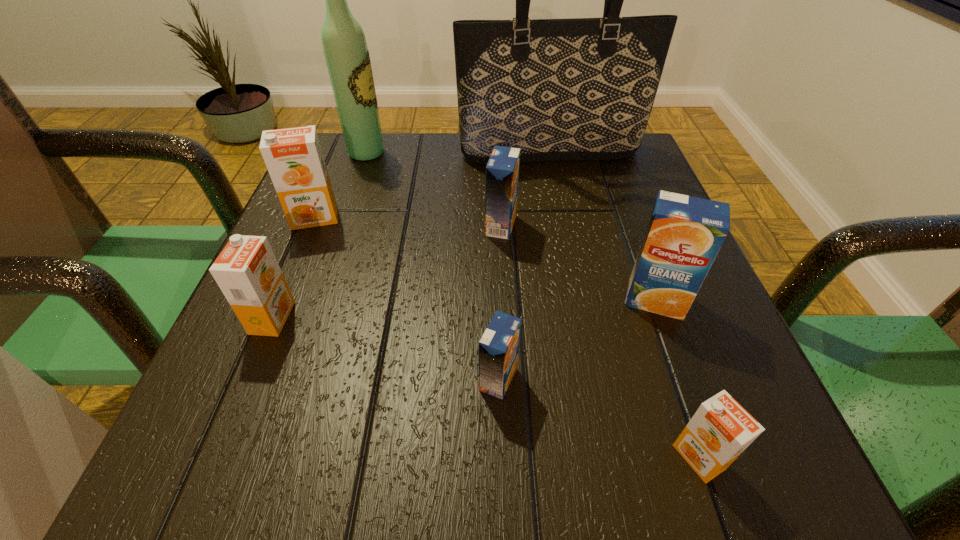
Where is `blue orange_juice that is the closest to the farthest orange orange juice`? This screenshot has height=540, width=960. blue orange_juice that is the closest to the farthest orange orange juice is located at coordinates (502, 171).

Locate an element on the screen. This screenshot has width=960, height=540. the closest blue orange_juice to the white wine bottle is located at coordinates [x=502, y=171].

At what (x,y) coordinates should I click in order to perform the action: click on vacant area in the image that satisfies the following two spatial constraints: 1. on the front-facing side of the nearest object; 2. on the left side of the seventh shortest object. Please return your answer as a coordinate pair (x, y). The width and height of the screenshot is (960, 540). Looking at the image, I should click on (263, 457).

Where is `vacant space that satisfies the following two spatial constraints: 1. on the front-facing side of the second tallest object; 2. on the left side of the nearest object`? The height and width of the screenshot is (540, 960). vacant space that satisfies the following two spatial constraints: 1. on the front-facing side of the second tallest object; 2. on the left side of the nearest object is located at coordinates (263, 457).

Locate an element on the screen. The height and width of the screenshot is (540, 960). vacant area that satisfies the following two spatial constraints: 1. on the front-facing side of the second biggest blue orange_juice; 2. on the right side of the white wine bottle is located at coordinates (342, 226).